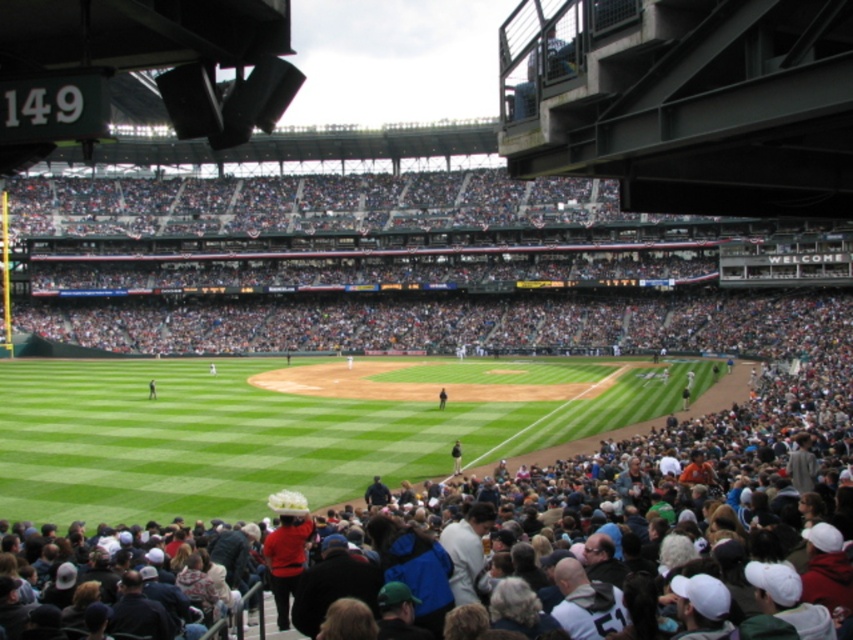
Between point (440, 392) and point (149, 390), which one is positioned behind?

Positioned behind is point (149, 390).

Does dark blue uniform at center appear on the left side of dark blue jersey at center?

No, dark blue uniform at center is not to the left of dark blue jersey at center.

This screenshot has width=853, height=640. I want to click on dark blue uniform at center, so click(442, 397).

Is dark blue jacket at center further to camera compared to dark blue jersey at center?

No.

Which is more to the left, dark blue jacket at center or dark blue jersey at center?

From the viewer's perspective, dark blue jersey at center appears more on the left side.

Identify the location of dark blue jacket at center. The image size is (853, 640). (456, 458).

Identify the location of dark blue jacket at center. (456, 458).

The image size is (853, 640). Identify the location of dark blue jacket at center. (456, 458).

Is point (456, 458) positioned behind point (440, 394)?

That is False.

Between point (453, 472) and point (444, 390), which one is positioned in front?

Point (453, 472) is more forward.

I want to click on dark blue jacket at center, so click(x=456, y=458).